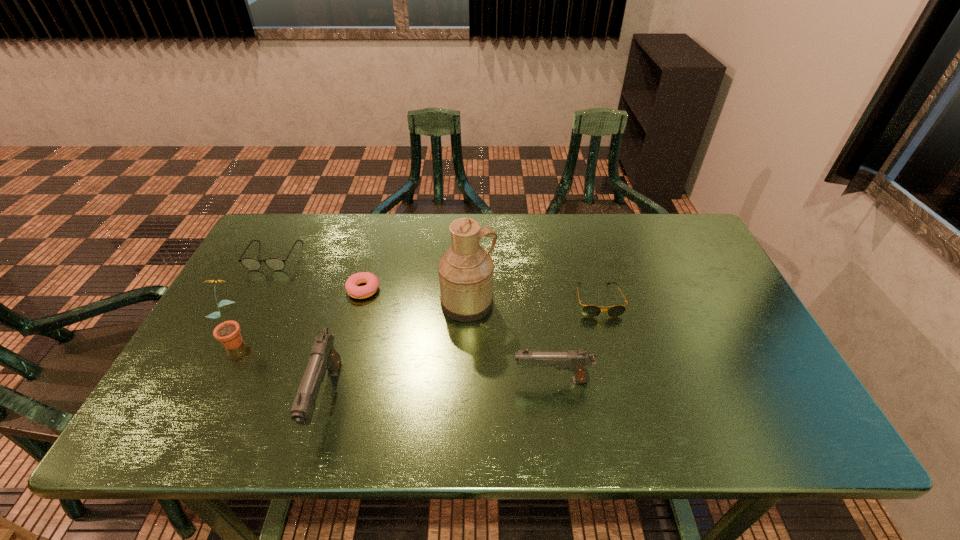
I want to click on sunflower situated at the left edge, so click(228, 333).

The image size is (960, 540). What are the coordinates of `spectacles that is at the left edge` in the screenshot? It's located at (252, 264).

This screenshot has height=540, width=960. Find the location of `object at the far left corner`. object at the far left corner is located at coordinates (252, 264).

Where is `vacant region at the far edge`? This screenshot has width=960, height=540. vacant region at the far edge is located at coordinates (322, 254).

In the image, there is a desktop. Where is `vacant space at the near edge`? vacant space at the near edge is located at coordinates (253, 373).

This screenshot has width=960, height=540. Find the location of `vacant space at the right edge`. vacant space at the right edge is located at coordinates (732, 355).

Where is `free space at the near left corner of the desktop`? free space at the near left corner of the desktop is located at coordinates pyautogui.click(x=213, y=382).

At what (x,y) coordinates should I click in order to perform the action: click on free space at the far right corner of the desktop. Please return your answer as a coordinate pair (x, y). Looking at the image, I should click on (681, 249).

The width and height of the screenshot is (960, 540). I want to click on vacant position at the near right corner of the desktop, so click(x=722, y=372).

The width and height of the screenshot is (960, 540). I want to click on free spot between the spectacles and the right gun, so click(413, 318).